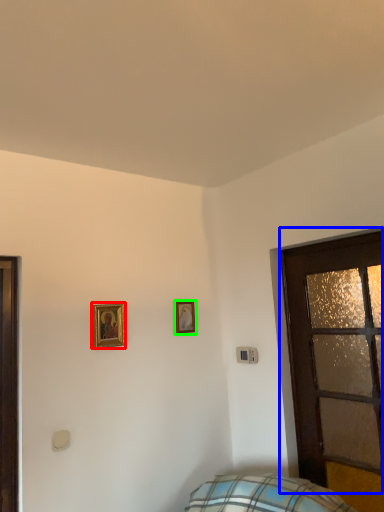
Question: Considering the real-world distances, which object is farthest from picture frame (highlighted by a red box)? door (highlighted by a blue box) or picture frame (highlighted by a green box)?

Choices:
 (A) door
 (B) picture frame

Answer: (A)